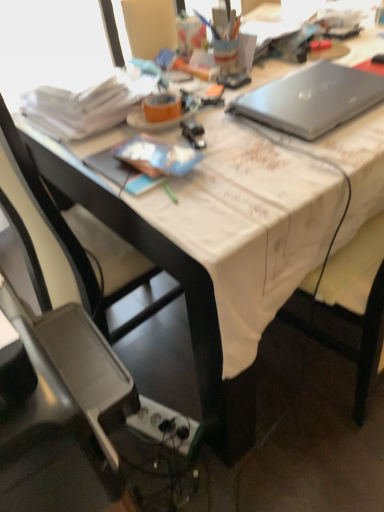
Identify the location of plastic gray chair at lower left, arranged as the first chair when viewed from the front. The width and height of the screenshot is (384, 512). (72, 375).

You are a GUI agent. You are given a task and a screenshot of the screen. Output one action in this format:
    pyautogui.click(x=<x>, y=<y>)
    Task: Click on the black plastic chair at lower left, which appears as the 2th chair when viewed from the front
    This screenshot has width=384, height=512.
    Given the screenshot: What is the action you would take?
    pyautogui.click(x=71, y=241)

I want to click on white plastic power outlet at lower center, so click(x=166, y=426).

The image size is (384, 512). What are the coordinates of `plastic gray chair at lower left, the 2th chair viewed from the back` in the screenshot? It's located at (72, 375).

Looking at the image, does plastic gray chair at lower left, the 2th chair viewed from the back, seem bigger or smaller compared to metallic silver stapler at center?

In the image, plastic gray chair at lower left, the 2th chair viewed from the back, appears to be larger than metallic silver stapler at center.

In the scene shown: Does plastic gray chair at lower left, the 2th chair viewed from the back, have a lesser width compared to metallic silver stapler at center?

Incorrect, the width of plastic gray chair at lower left, the 2th chair viewed from the back, is not less than that of metallic silver stapler at center.

From the picture: Is plastic gray chair at lower left, the 2th chair viewed from the back, further to the viewer compared to metallic silver stapler at center?

That is False.

Is silver metallic laptop at upper right thinner than plastic gray chair at lower left, arranged as the first chair when viewed from the front?

Yes, silver metallic laptop at upper right is thinner than plastic gray chair at lower left, arranged as the first chair when viewed from the front.

Would you consider silver metallic laptop at upper right to be distant from plastic gray chair at lower left, arranged as the first chair when viewed from the front?

No, silver metallic laptop at upper right is in close proximity to plastic gray chair at lower left, arranged as the first chair when viewed from the front.

Between point (335, 66) and point (80, 393), which one is positioned in front?

The point (80, 393) is closer.

From the image's perspective, is silver metallic laptop at upper right below plastic gray chair at lower left, the 2th chair viewed from the back?

No, from the image's perspective, silver metallic laptop at upper right is not beneath plastic gray chair at lower left, the 2th chair viewed from the back.

Consider the image. Is silver metallic laptop at upper right facing away from black plastic chair at lower left, which appears as the 2th chair when viewed from the front?

No.

Considering the positions of objects silver metallic laptop at upper right and black plastic chair at lower left, which is the first chair from back to front, in the image provided, who is behind, silver metallic laptop at upper right or black plastic chair at lower left, which is the first chair from back to front,?

silver metallic laptop at upper right is further from the camera.

What's the angular difference between silver metallic laptop at upper right and black plastic chair at lower left, which is the first chair from back to front,'s facing directions?

There is a 2.05-degree angle between the facing directions of silver metallic laptop at upper right and black plastic chair at lower left, which is the first chair from back to front.

Is silver metallic laptop at upper right to the right of black plastic chair at lower left, which is the first chair from back to front, from the viewer's perspective?

Yes, silver metallic laptop at upper right is to the right of black plastic chair at lower left, which is the first chair from back to front.

Is black plastic chair at lower left, which is the first chair from back to front, in contact with metallic silver stapler at center?

No, black plastic chair at lower left, which is the first chair from back to front, is not making contact with metallic silver stapler at center.

Where is `stationery that is behind the black plastic chair at lower left, which is the first chair from back to front`? stationery that is behind the black plastic chair at lower left, which is the first chair from back to front is located at coordinates (193, 133).

How many degrees apart are the facing directions of metallic silver stapler at center and silver metallic laptop at upper right?

metallic silver stapler at center and silver metallic laptop at upper right are facing 22.4 degrees away from each other.

Considering the relative positions of metallic silver stapler at center and silver metallic laptop at upper right in the image provided, is metallic silver stapler at center to the left or to the right of silver metallic laptop at upper right?

metallic silver stapler at center is to the left of silver metallic laptop at upper right.

Considering the sizes of objects metallic silver stapler at center and silver metallic laptop at upper right in the image provided, who is smaller, metallic silver stapler at center or silver metallic laptop at upper right?

metallic silver stapler at center.

Is metallic silver stapler at center wider than silver metallic laptop at upper right?

In fact, metallic silver stapler at center might be narrower than silver metallic laptop at upper right.

From the image's perspective, would you say black plastic chair at lower left, which is the first chair from back to front, is positioned over white plastic power outlet at lower center?

Yes, from the image's perspective, black plastic chair at lower left, which is the first chair from back to front, is above white plastic power outlet at lower center.

Is black plastic chair at lower left, which is the first chair from back to front, directly adjacent to white plastic power outlet at lower center?

No, black plastic chair at lower left, which is the first chair from back to front, is not with white plastic power outlet at lower center.

Where is `the 1st chair above the white plastic power outlet at lower center (from a real-world perspective)`? The width and height of the screenshot is (384, 512). the 1st chair above the white plastic power outlet at lower center (from a real-world perspective) is located at coordinates (71, 241).

How distant is metallic silver stapler at center from plastic gray chair at lower left, the 2th chair viewed from the back?

51.58 centimeters.

Is there a large distance between metallic silver stapler at center and plastic gray chair at lower left, arranged as the first chair when viewed from the front?

That's not correct — metallic silver stapler at center is a little close to plastic gray chair at lower left, arranged as the first chair when viewed from the front.

Is metallic silver stapler at center taller than plastic gray chair at lower left, arranged as the first chair when viewed from the front?

No.

Which is farther, (195, 136) or (41, 400)?

The point (195, 136) is farther.

Starting from the metallic silver stapler at center, which chair is the 2nd one in front? Please provide its 2D coordinates.

[(72, 375)]

Where is `chair that is the 2nd object located below the silver metallic laptop at upper right (from the image's perspective)`? This screenshot has height=512, width=384. chair that is the 2nd object located below the silver metallic laptop at upper right (from the image's perspective) is located at coordinates (72, 375).

Which object lies nearer to the anchor point metallic silver stapler at center, black plastic chair at lower left, which appears as the 2th chair when viewed from the front, or plastic gray chair at lower left, the 2th chair viewed from the back?

black plastic chair at lower left, which appears as the 2th chair when viewed from the front.

Based on the photo, considering their positions, is plastic gray chair at lower left, arranged as the first chair when viewed from the front, positioned further to black plastic chair at lower left, which appears as the 2th chair when viewed from the front, than white plastic power outlet at lower center?

Based on the image, white plastic power outlet at lower center appears to be further to black plastic chair at lower left, which appears as the 2th chair when viewed from the front.

When comparing their distances from white plastic power outlet at lower center, does metallic silver stapler at center or black plastic chair at lower left, which appears as the 2th chair when viewed from the front, seem further?

metallic silver stapler at center.

From the image, which object appears to be nearer to metallic silver stapler at center, silver metallic laptop at upper right or plastic gray chair at lower left, arranged as the first chair when viewed from the front?

The object closer to metallic silver stapler at center is silver metallic laptop at upper right.

When comparing their distances from plastic gray chair at lower left, arranged as the first chair when viewed from the front, does silver metallic laptop at upper right or white plastic power outlet at lower center seem closer?

Among the two, white plastic power outlet at lower center is located nearer to plastic gray chair at lower left, arranged as the first chair when viewed from the front.

Looking at the image, which one is located further to white plastic power outlet at lower center, black plastic chair at lower left, which is the first chair from back to front, or plastic gray chair at lower left, arranged as the first chair when viewed from the front?

plastic gray chair at lower left, arranged as the first chair when viewed from the front, lies further to white plastic power outlet at lower center than the other object.

Which object lies further to the anchor point white plastic power outlet at lower center, silver metallic laptop at upper right or black plastic chair at lower left, which is the first chair from back to front?

Based on the image, silver metallic laptop at upper right appears to be further to white plastic power outlet at lower center.

In the scene shown: Which object lies nearer to the anchor point black plastic chair at lower left, which is the first chair from back to front, white plastic power outlet at lower center or plastic gray chair at lower left, arranged as the first chair when viewed from the front?

The object closer to black plastic chair at lower left, which is the first chair from back to front, is plastic gray chair at lower left, arranged as the first chair when viewed from the front.

Find the location of a particular element. stationery positioned between plastic gray chair at lower left, the 2th chair viewed from the back, and white plastic power outlet at lower center from near to far is located at coordinates (193, 133).

Image resolution: width=384 pixels, height=512 pixels. In order to click on chair located between plastic gray chair at lower left, arranged as the first chair when viewed from the front, and white plastic power outlet at lower center in the depth direction in this screenshot , I will do `click(71, 241)`.

Locate an element on the screen. Image resolution: width=384 pixels, height=512 pixels. stationery between silver metallic laptop at upper right and white plastic power outlet at lower center from top to bottom is located at coordinates (193, 133).

Identify the location of stationery between silver metallic laptop at upper right and plastic gray chair at lower left, the 2th chair viewed from the back, in the up-down direction. This screenshot has height=512, width=384. (193, 133).